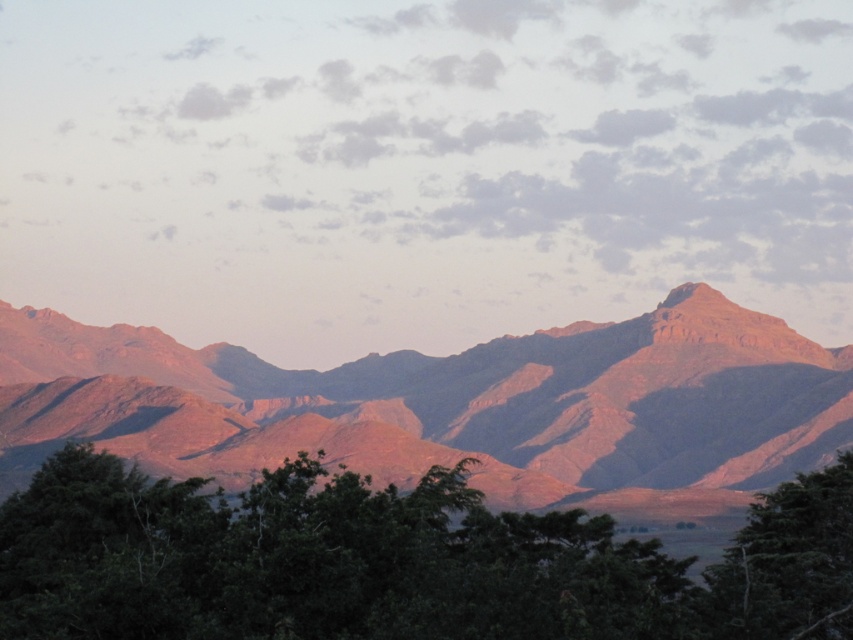
Question: Does rustic rock mountain range at center appear on the right side of green leafy tree at lower center?

Choices:
 (A) yes
 (B) no

Answer: (A)

Question: Does rustic rock mountain range at center have a greater width compared to green leafy tree at lower center?

Choices:
 (A) yes
 (B) no

Answer: (A)

Question: Among these points, which one is farthest from the camera?

Choices:
 (A) (252, 522)
 (B) (190, 412)

Answer: (B)

Question: Which of the following is the closest to the observer?

Choices:
 (A) green leafy tree at lower right
 (B) rustic rock mountain range at center

Answer: (A)

Question: Does rustic rock mountain range at center appear on the right side of green leafy tree at lower right?

Choices:
 (A) no
 (B) yes

Answer: (A)

Question: Which object appears farthest from the camera in this image?

Choices:
 (A) rustic rock mountain range at center
 (B) green leafy tree at lower right
 (C) green leafy tree at lower center

Answer: (A)